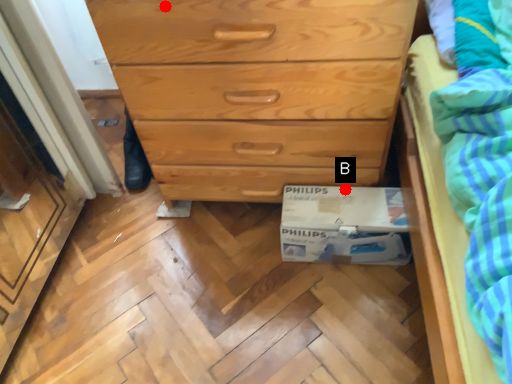
Question: Two points are circled on the image, labeled by A and B beside each circle. Among these points, which one is farthest from the camera?

Choices:
 (A) A is further
 (B) B is further

Answer: (B)